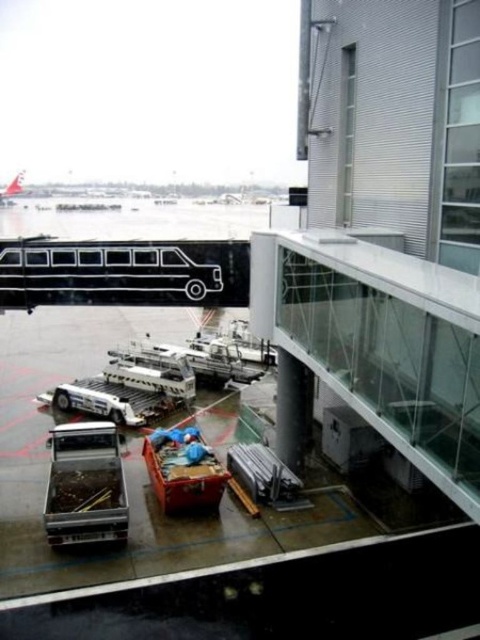
Question: Considering the real-world distances, which object is farthest from the metallic silver bus at lower left?

Choices:
 (A) black matte bus at upper left
 (B) white glossy airplane at upper left

Answer: (B)

Question: Where is metallic silver bus at lower left located in relation to white glossy airplane at upper left in the image?

Choices:
 (A) right
 (B) left

Answer: (A)

Question: Is black matte bus at upper left wider than metallic silver bus at lower left?

Choices:
 (A) no
 (B) yes

Answer: (A)

Question: Can you confirm if black matte bus at upper left is wider than metallic silver bus at lower left?

Choices:
 (A) yes
 (B) no

Answer: (B)

Question: Based on their relative distances, which object is nearer to the black matte bus at upper left?

Choices:
 (A) metallic silver bus at lower left
 (B) white glossy airplane at upper left

Answer: (A)

Question: Which object is closer to the camera taking this photo?

Choices:
 (A) metallic silver bus at lower left
 (B) black matte bus at upper left

Answer: (A)